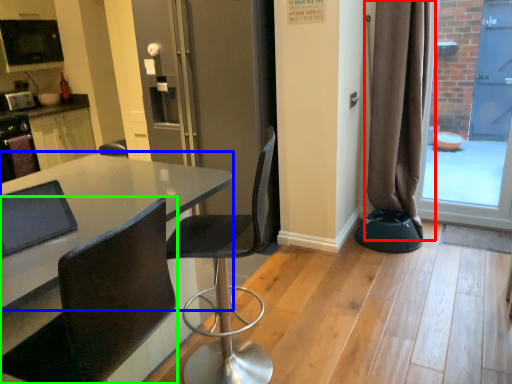
Question: Which object is positioned farthest from curtain (highlighted by a red box)? Select from table (highlighted by a blue box) and chair (highlighted by a green box).

Choices:
 (A) table
 (B) chair

Answer: (B)